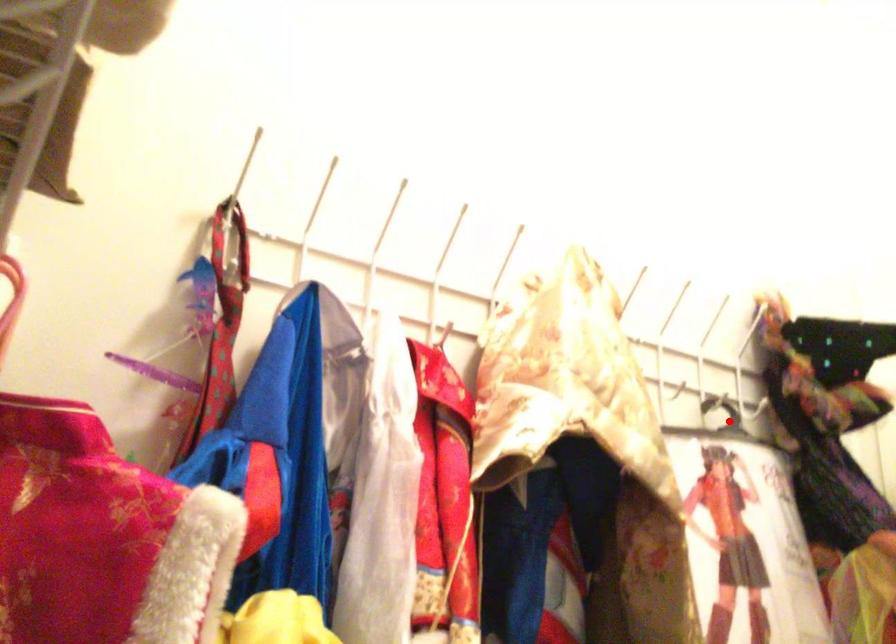
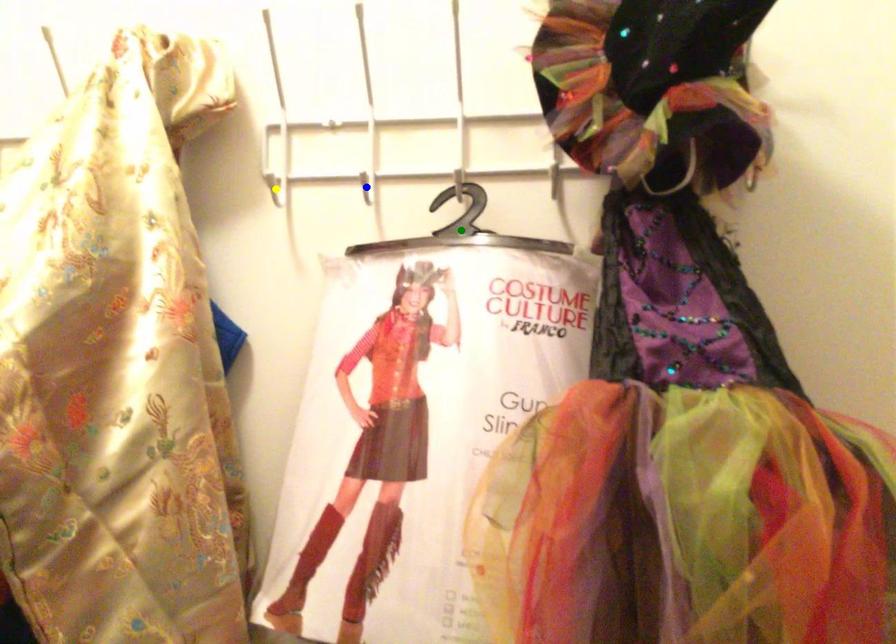
Question: I am providing you with two images of the same scene from different viewpoints. A red point is marked on the first image. You are given multiple points on the second image. In image 2, which mark is for the same physical point as the one in image 1?

Choices:
 (A) yellow point
 (B) blue point
 (C) green point

Answer: (C)